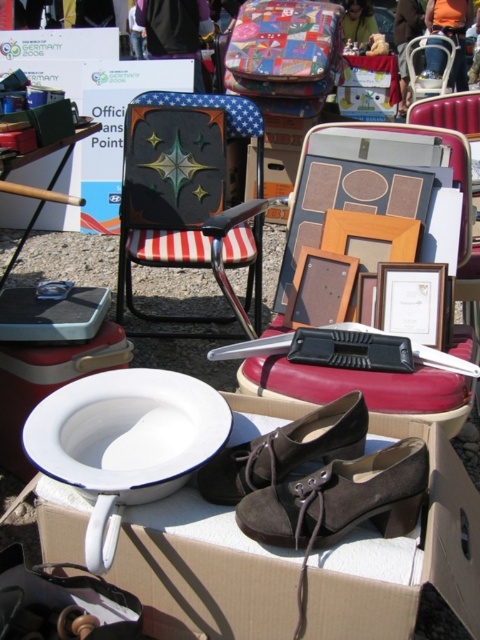
Question: Does metallic painted chair at center appear under suede shoe at center?

Choices:
 (A) yes
 (B) no

Answer: (B)

Question: Which point appears farthest from the camera in this image?

Choices:
 (A) (272, 433)
 (B) (190, 257)
 (C) (91, 525)
 (D) (442, 44)

Answer: (D)

Question: Among these points, which one is farthest from the camera?

Choices:
 (A) (261, 275)
 (B) (288, 486)

Answer: (A)

Question: Is the position of white cardboard box at center less distant than that of white enameled toilet bowl at lower left?

Choices:
 (A) no
 (B) yes

Answer: (B)

Question: Is white cardboard box at center below brown suede shoe at center?

Choices:
 (A) no
 (B) yes

Answer: (B)

Question: Which object appears farthest from the camera in this image?

Choices:
 (A) white enamel toilet at center
 (B) white cardboard box at center
 (C) metallic silver chair at upper center

Answer: (C)